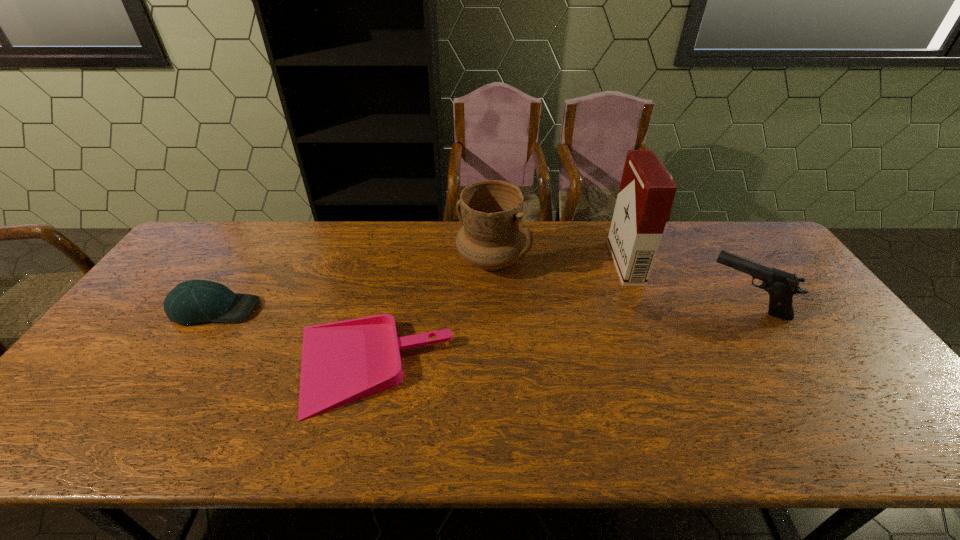
Locate an element on the screen. This screenshot has width=960, height=540. unoccupied area between the dustpan and the baseball cap is located at coordinates (292, 339).

At what (x,y) coordinates should I click in order to perform the action: click on free space between the dustpan and the rightmost object. Please return your answer as a coordinate pair (x, y). The width and height of the screenshot is (960, 540). Looking at the image, I should click on (558, 336).

Where is `vacant area between the tallest object and the fourth tallest object`? vacant area between the tallest object and the fourth tallest object is located at coordinates (420, 286).

Identify the location of empty space between the cigarette_case and the pottery. This screenshot has height=540, width=960. (559, 262).

Where is `vacant area that lies between the shortest object and the rightmost object`? This screenshot has width=960, height=540. vacant area that lies between the shortest object and the rightmost object is located at coordinates (558, 336).

Locate an element on the screen. This screenshot has height=540, width=960. vacant space in between the tallest object and the gun is located at coordinates (685, 284).

Locate an element on the screen. This screenshot has width=960, height=540. empty location between the second object from right to left and the fourth shortest object is located at coordinates (559, 262).

Locate an element on the screen. vacant space in between the tallest object and the rightmost object is located at coordinates (685, 284).

At what (x,y) coordinates should I click in order to perform the action: click on blank region between the pottery and the tallest object. Please return your answer as a coordinate pair (x, y). Looking at the image, I should click on (559, 262).

Point out which object is positioned as the fourth nearest to the fourth shortest object. Please provide its 2D coordinates. Your answer should be formatted as a tuple, i.e. [(x, y)], where the tuple contains the x and y coordinates of a point satisfying the conditions above.

[(195, 301)]